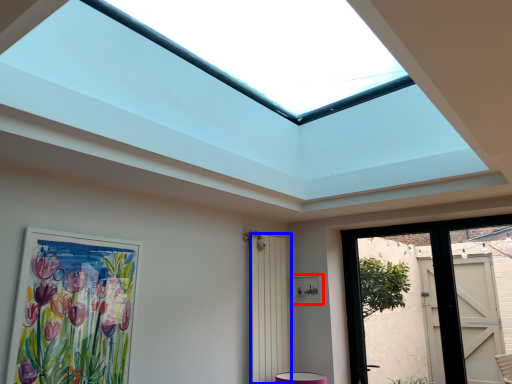
Question: Which of the following is the farthest to the observer, picture frame (highlighted by a red box) or screen door (highlighted by a blue box)?

Choices:
 (A) picture frame
 (B) screen door

Answer: (A)